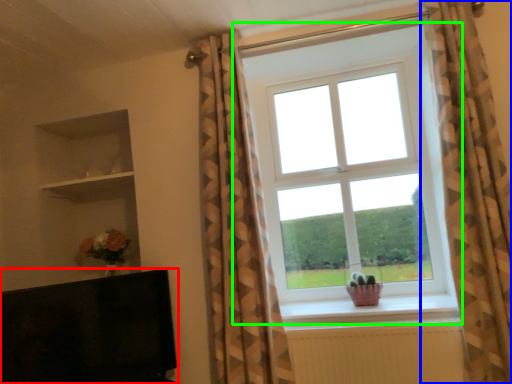
Question: Which object is the closest to the furniture (highlighted by a red box)? Choose among these: curtain (highlighted by a blue box) or window (highlighted by a green box).

Choices:
 (A) curtain
 (B) window

Answer: (B)